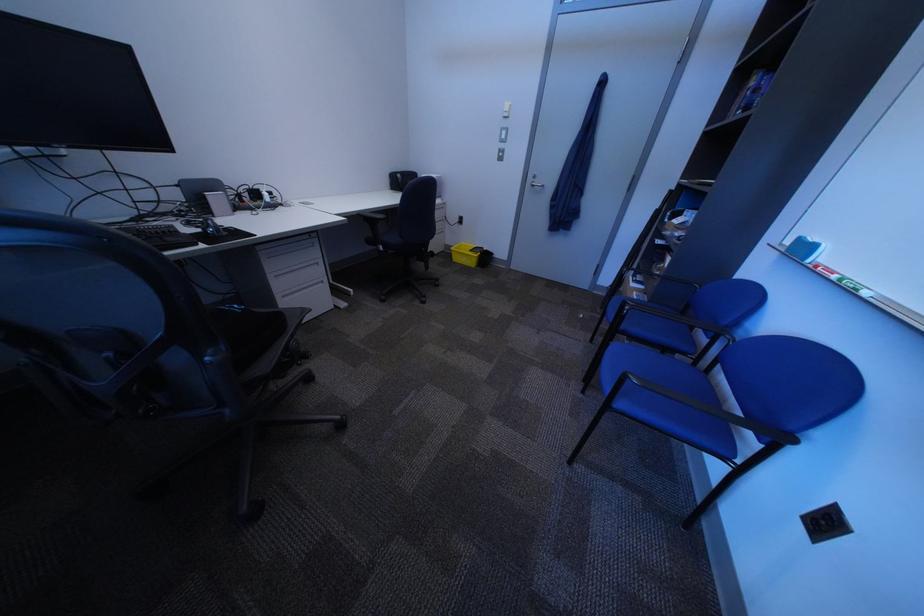
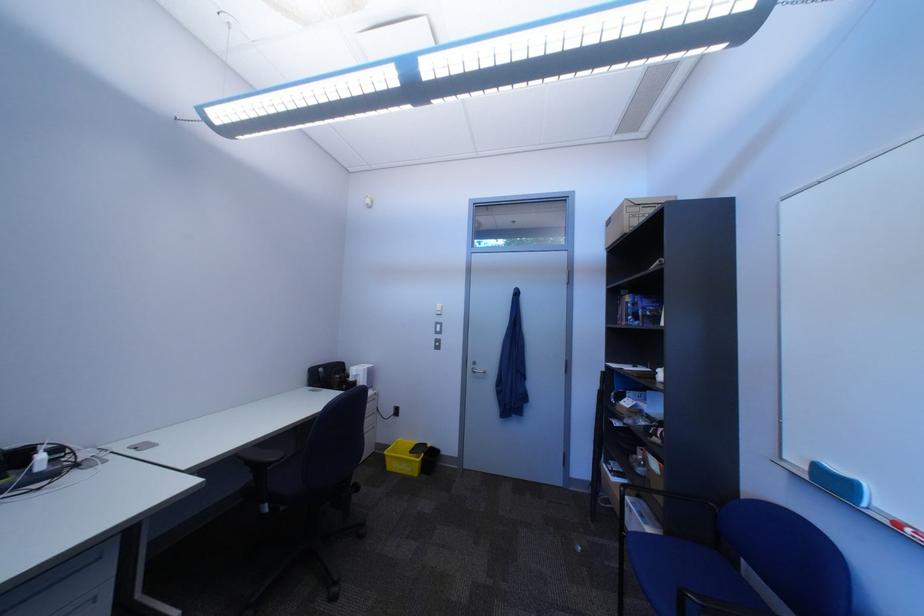
In the second image, find the point that corresponds to (832,267) in the first image.

(915, 527)